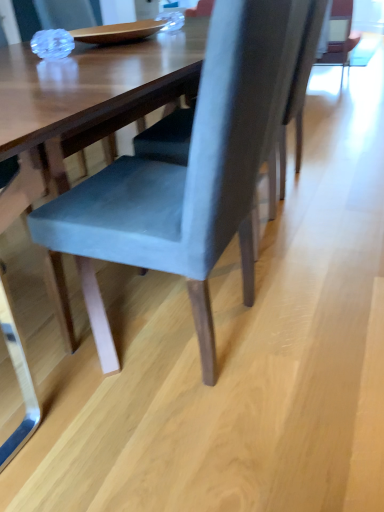
Where is `free space in front of suede-like gray chair at center, the 2th chair viewed from the front`? The height and width of the screenshot is (512, 384). free space in front of suede-like gray chair at center, the 2th chair viewed from the front is located at coordinates (288, 291).